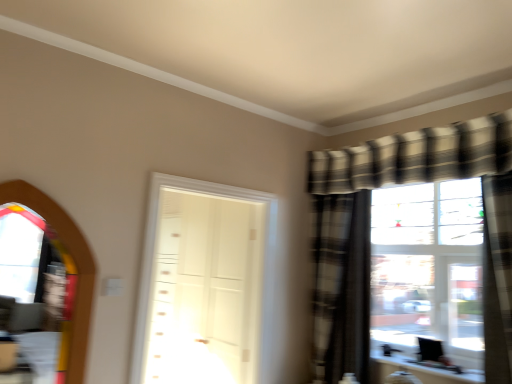
Question: Looking at the image, does transparent glass window screen at left seem bigger or smaller compared to white glossy door at center?

Choices:
 (A) big
 (B) small

Answer: (B)

Question: From the image's perspective, relative to white glossy door at center, is transparent glass window screen at left above or below?

Choices:
 (A) below
 (B) above

Answer: (B)

Question: Based on their relative distances, which object is farther from the plaid fabric curtain at right, placed as the first curtain when sorted from right to left?

Choices:
 (A) white glossy door at center
 (B) transparent glass window screen at left
 (C) plaid fabric curtain at right, which is the first curtain in left-to-right order

Answer: (B)

Question: Which object is the closest to the transparent glass window screen at left?

Choices:
 (A) white glossy door at center
 (B) plaid fabric curtain at right, the first curtain from the front
 (C) plaid fabric curtain at right, the 2th curtain viewed from the right

Answer: (A)